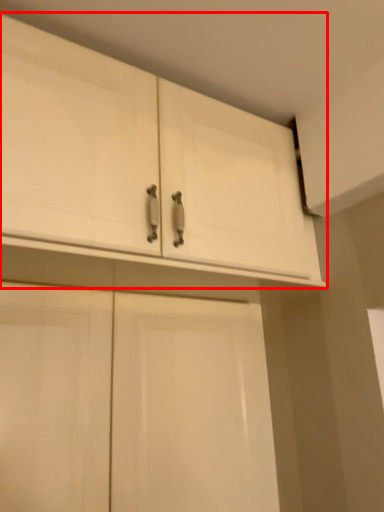
Question: From the image's perspective, where is cabinetry (annotated by the red box) located relative to cabinetry?

Choices:
 (A) below
 (B) above

Answer: (B)